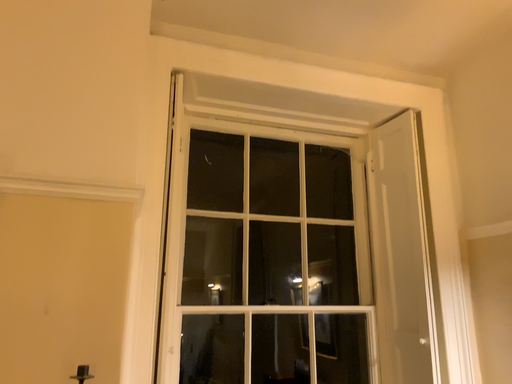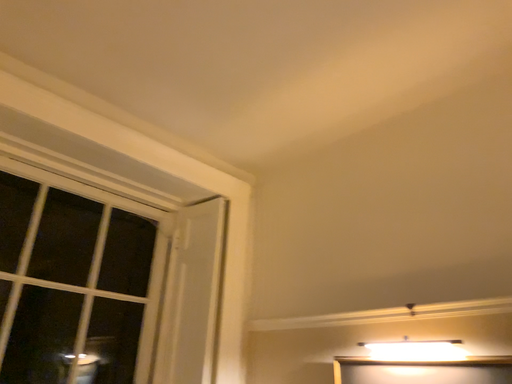
Question: Which way did the camera rotate in the video?

Choices:
 (A) rotated right
 (B) rotated left

Answer: (A)